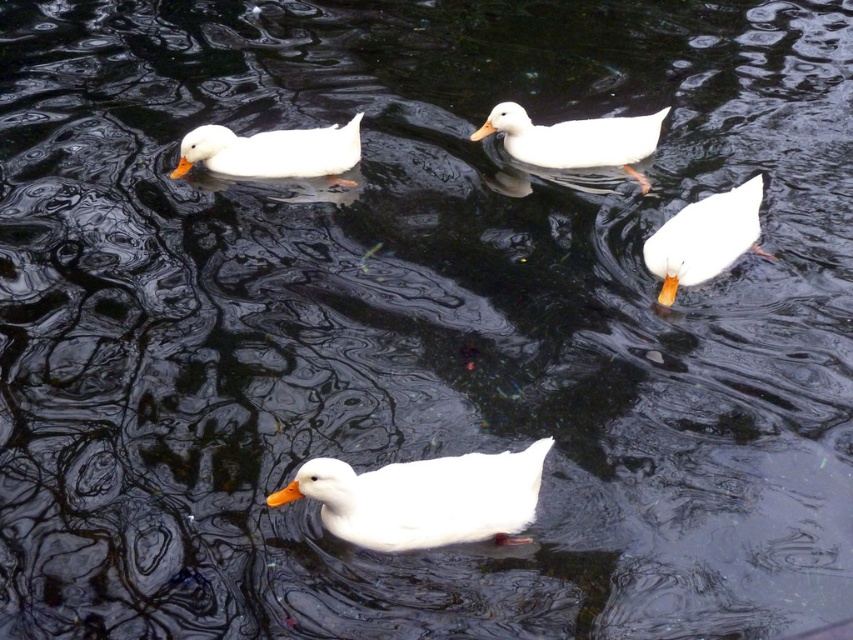
Question: Is the position of white matte duck at center more distant than that of white matte duck at upper center?

Choices:
 (A) no
 (B) yes

Answer: (A)

Question: Is white matte duck at center closer to camera compared to white matte duck at upper center?

Choices:
 (A) no
 (B) yes

Answer: (B)

Question: Among these objects, which one is nearest to the camera?

Choices:
 (A) white matte duck at upper right
 (B) white matte duck at center

Answer: (B)

Question: Which object is the closest to the white matte duck at upper left?

Choices:
 (A) white matte duck at upper right
 (B) white matte duck at upper center

Answer: (B)

Question: Which point is farther to the camera?

Choices:
 (A) white matte duck at upper right
 (B) white matte duck at upper left
 (C) white matte duck at upper center
 (D) white matte duck at center

Answer: (C)

Question: Observing the image, what is the correct spatial positioning of white matte duck at upper right in reference to white matte duck at upper center?

Choices:
 (A) below
 (B) above

Answer: (A)